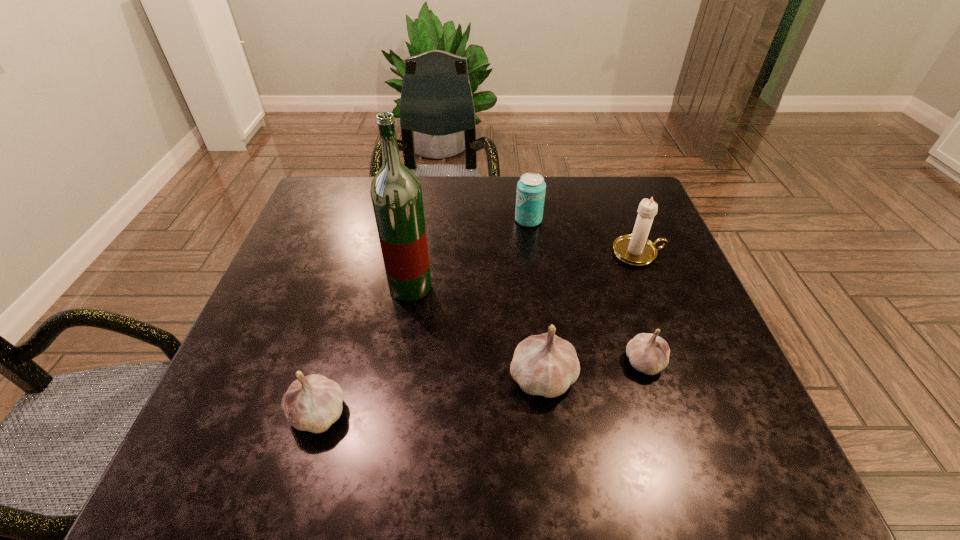
To achieve even spacing by inserting another garlic among them, please point to a vacant spot for this new garlic. Please provide its 2D coordinates. Your answer should be formatted as a tuple, i.e. [(x, y)], where the tuple contains the x and y coordinates of a point satisfying the conditions above.

[(434, 395)]